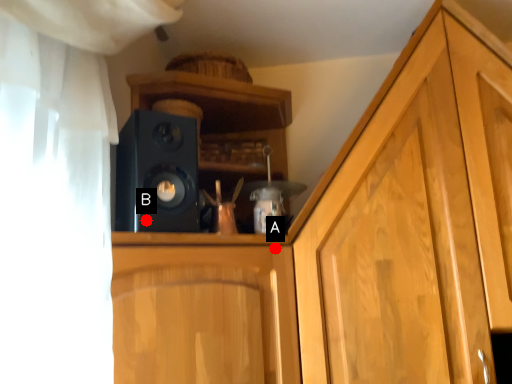
Question: Two points are circled on the image, labeled by A and B beside each circle. Which point is farther from the camera taking this photo?

Choices:
 (A) A is further
 (B) B is further

Answer: (A)